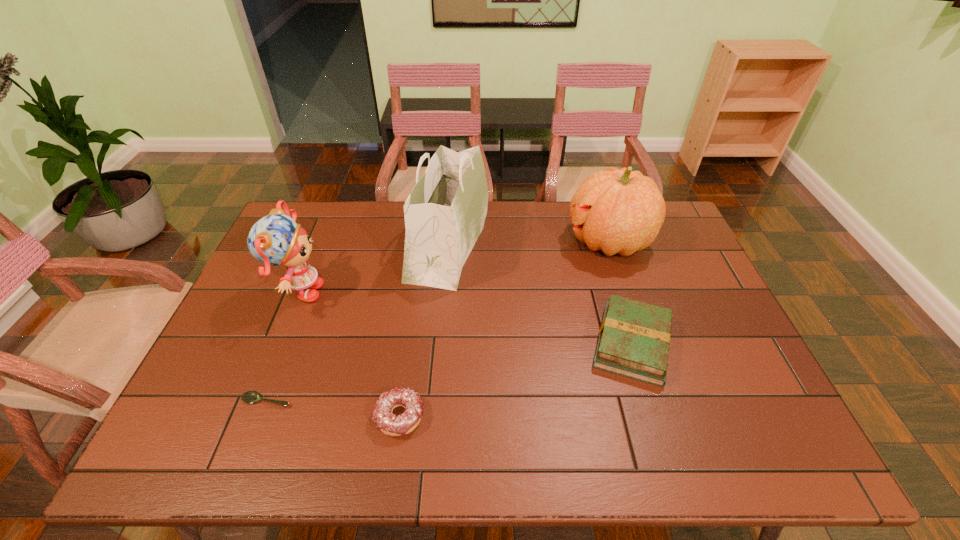
This screenshot has height=540, width=960. What are the coordinates of `free space in the image that satisfies the following two spatial constraints: 1. on the face of the doll; 2. on the left side of the book` in the screenshot? It's located at (278, 344).